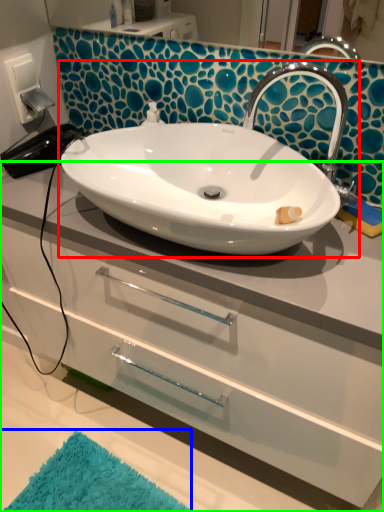
Question: Which object is the farthest from sink (highlighted by a red box)? Choose among these: bath mat (highlighted by a blue box) or bathroom cabinet (highlighted by a green box).

Choices:
 (A) bath mat
 (B) bathroom cabinet

Answer: (A)